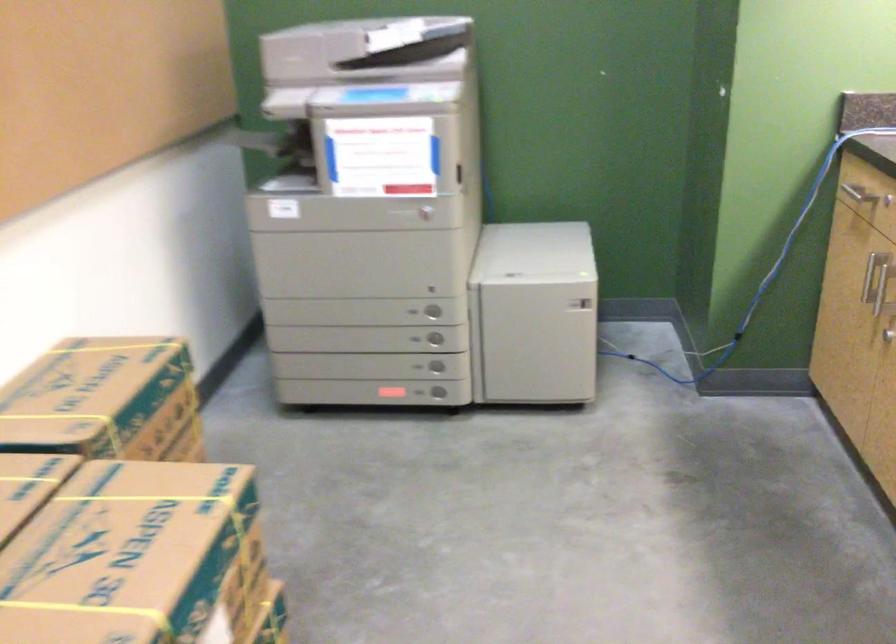
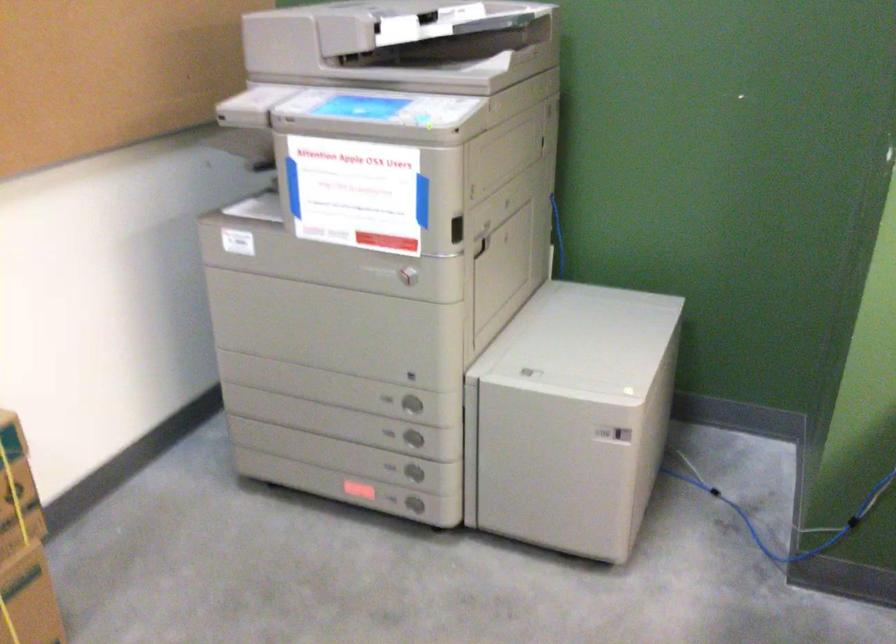
Which direction would the cameraman need to move to produce the second image?

The cameraman moved toward right, forward.